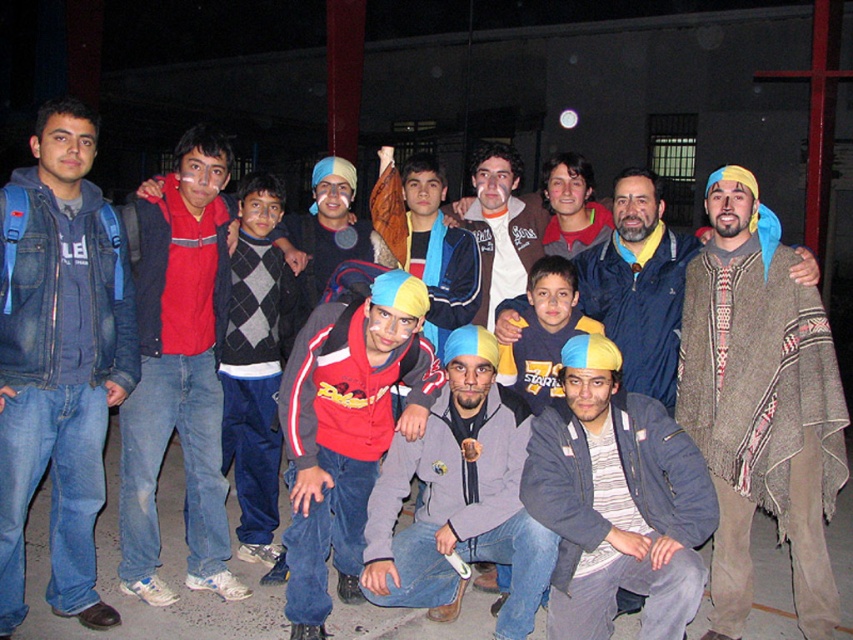
Is point (486, 216) positioned before point (300, 221)?

No, it is behind (300, 221).

Image resolution: width=853 pixels, height=640 pixels. What do you see at coordinates (500, 227) in the screenshot? I see `matte white mask at center` at bounding box center [500, 227].

The width and height of the screenshot is (853, 640). Find the location of `matte white mask at center`. matte white mask at center is located at coordinates [x=500, y=227].

Is the position of denim jacket at left less distant than that of blue-yellow knit cap at lower center?

No, denim jacket at left is behind blue-yellow knit cap at lower center.

Between point (54, 404) and point (556, 419), which one is positioned behind?

Point (556, 419)

At what (x,y) coordinates should I click in order to perform the action: click on denim jacket at left. Please return your answer as a coordinate pair (x, y). Image resolution: width=853 pixels, height=640 pixels. Looking at the image, I should click on (59, 358).

Is knitted wool poncho at center to the right of reddish-brown leather jacket at center from the viewer's perspective?

Correct, you'll find knitted wool poncho at center to the right of reddish-brown leather jacket at center.

Does knitted wool poncho at center have a larger size compared to reddish-brown leather jacket at center?

Correct, knitted wool poncho at center is larger in size than reddish-brown leather jacket at center.

Describe the element at coordinates (759, 404) in the screenshot. I see `knitted wool poncho at center` at that location.

Identify the location of knitted wool poncho at center. The height and width of the screenshot is (640, 853). (759, 404).